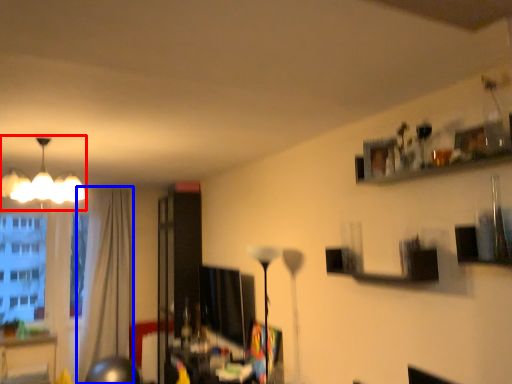
Question: Which object appears closest to the camera in this image, lamp (highlighted by a red box) or curtain (highlighted by a blue box)?

Choices:
 (A) lamp
 (B) curtain

Answer: (A)